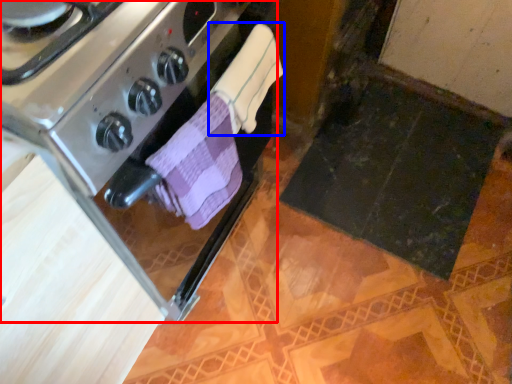
Question: Which point is further to the camera, kitchen appliance (highlighted by a red box) or bath towel (highlighted by a blue box)?

Choices:
 (A) kitchen appliance
 (B) bath towel

Answer: (B)